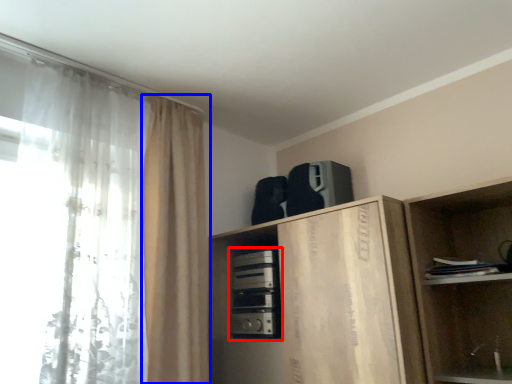
Question: Which object appears farthest to the camera in this image, appliance (highlighted by a red box) or curtain (highlighted by a blue box)?

Choices:
 (A) appliance
 (B) curtain

Answer: (A)